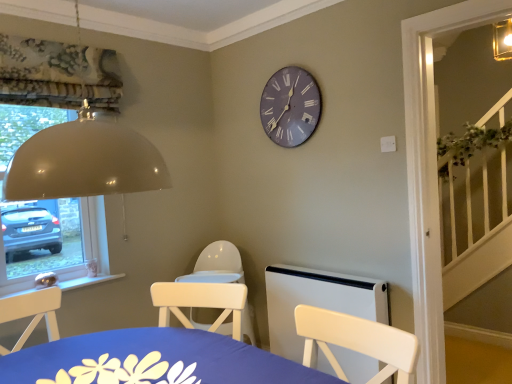
Question: Considering the relative sizes of white plastic radiator at lower center and matte gray clock at upper center in the image provided, is white plastic radiator at lower center bigger than matte gray clock at upper center?

Choices:
 (A) no
 (B) yes

Answer: (B)

Question: Is white plastic radiator at lower center completely or partially outside of matte gray clock at upper center?

Choices:
 (A) yes
 (B) no

Answer: (A)

Question: Does white plastic radiator at lower center have a lesser width compared to matte gray clock at upper center?

Choices:
 (A) yes
 (B) no

Answer: (B)

Question: Is white plastic radiator at lower center facing towards matte gray clock at upper center?

Choices:
 (A) no
 (B) yes

Answer: (A)

Question: From a real-world perspective, is white plastic radiator at lower center positioned under matte gray clock at upper center based on gravity?

Choices:
 (A) yes
 (B) no

Answer: (A)

Question: Does white plastic radiator at lower center come in front of matte gray clock at upper center?

Choices:
 (A) yes
 (B) no

Answer: (A)

Question: From the image's perspective, is matte gray clock at upper center over white plastic radiator at lower center?

Choices:
 (A) no
 (B) yes

Answer: (B)

Question: Is matte gray clock at upper center aimed at white plastic radiator at lower center?

Choices:
 (A) no
 (B) yes

Answer: (A)

Question: From the image's perspective, is matte gray clock at upper center located beneath white plastic radiator at lower center?

Choices:
 (A) yes
 (B) no

Answer: (B)

Question: Is matte gray clock at upper center surrounding white plastic radiator at lower center?

Choices:
 (A) yes
 (B) no

Answer: (B)

Question: Is matte gray clock at upper center closer to camera compared to white plastic radiator at lower center?

Choices:
 (A) no
 (B) yes

Answer: (A)

Question: Does matte gray clock at upper center have a smaller size compared to white plastic radiator at lower center?

Choices:
 (A) yes
 (B) no

Answer: (A)

Question: From a real-world perspective, is blue fabric table at lower center beneath matte gray clock at upper center?

Choices:
 (A) yes
 (B) no

Answer: (A)